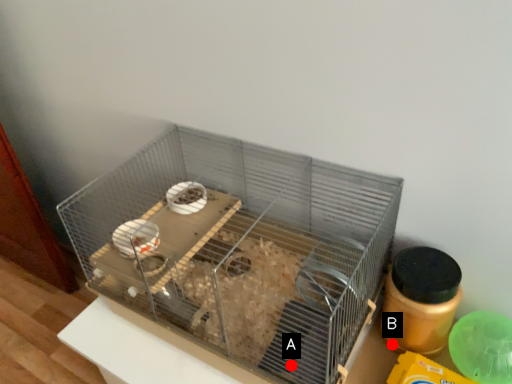
Question: Two points are circled on the image, labeled by A and B beside each circle. Which of the following is the farthest from the observer?

Choices:
 (A) A is further
 (B) B is further

Answer: (B)